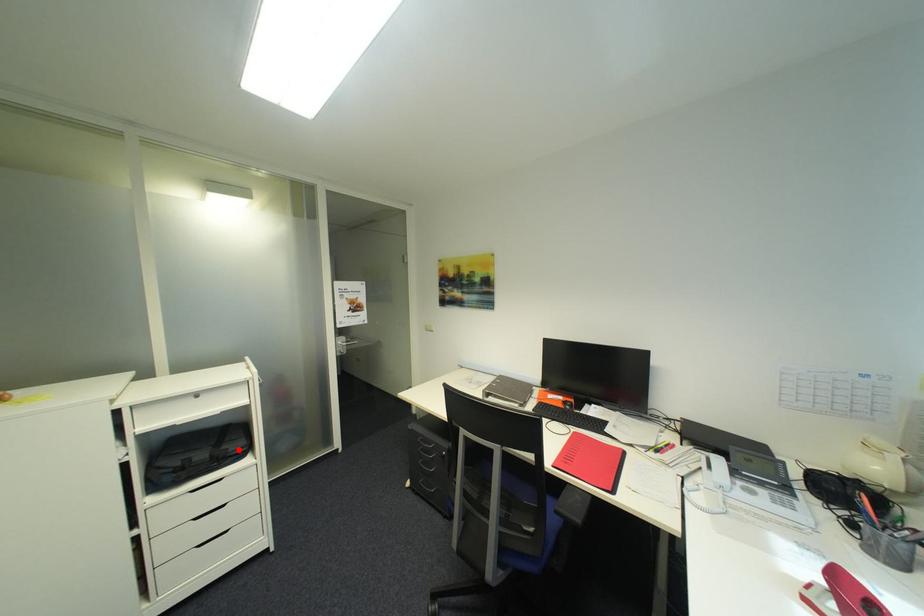
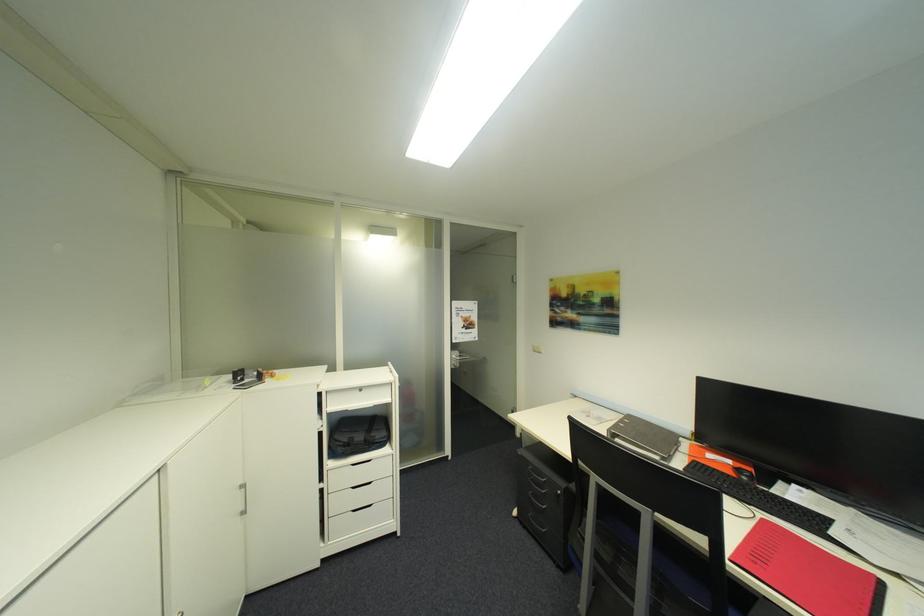
Where in the second image is the point corresponding to the highlighted location from the first image?

(384, 438)